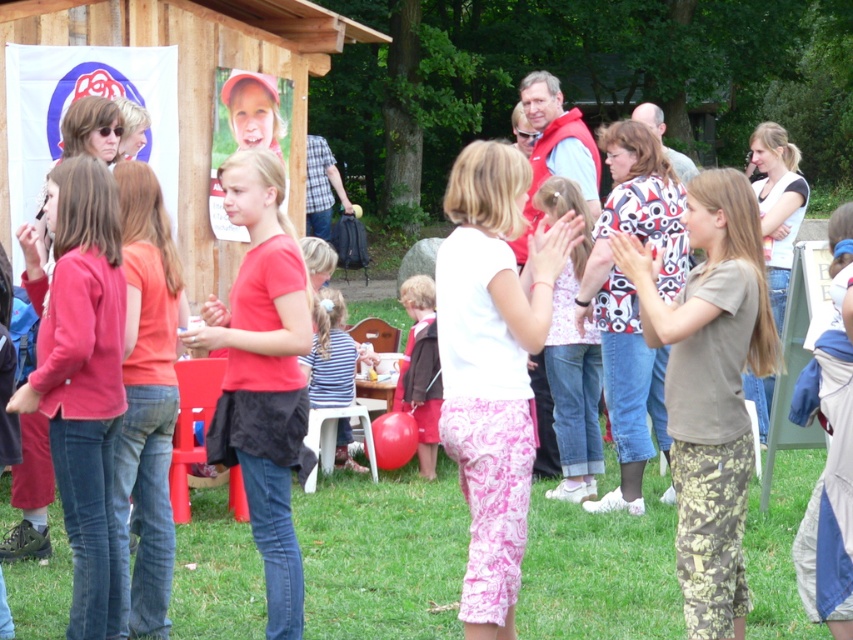
Which is behind, point (85, 621) or point (415, 285)?

The point (415, 285) is behind.

Is matte red jacket at left bigger than brown fabric jacket at center?

Yes, matte red jacket at left is bigger than brown fabric jacket at center.

Describe the element at coordinates (80, 376) in the screenshot. I see `matte red jacket at left` at that location.

Locate an element on the screen. This screenshot has height=640, width=853. matte red jacket at left is located at coordinates (80, 376).

The image size is (853, 640). Identify the location of green grass at center. (x=381, y=554).

In order to click on green grass at center in this screenshot , I will do `click(381, 554)`.

Between white cotton shirt at center and brown cotton shirt at center, which one appears on the right side from the viewer's perspective?

brown cotton shirt at center

Is point (489, 404) farther from camera compared to point (752, 244)?

No, (489, 404) is in front of (752, 244).

In order to click on white cotton shirt at center in this screenshot , I will do `click(492, 365)`.